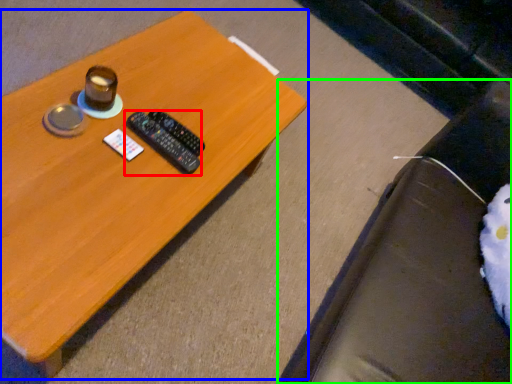
Question: Which object is the farthest from remote control (highlighted by a red box)? Choose among these: table (highlighted by a blue box) or bean bag chair (highlighted by a green box).

Choices:
 (A) table
 (B) bean bag chair

Answer: (B)